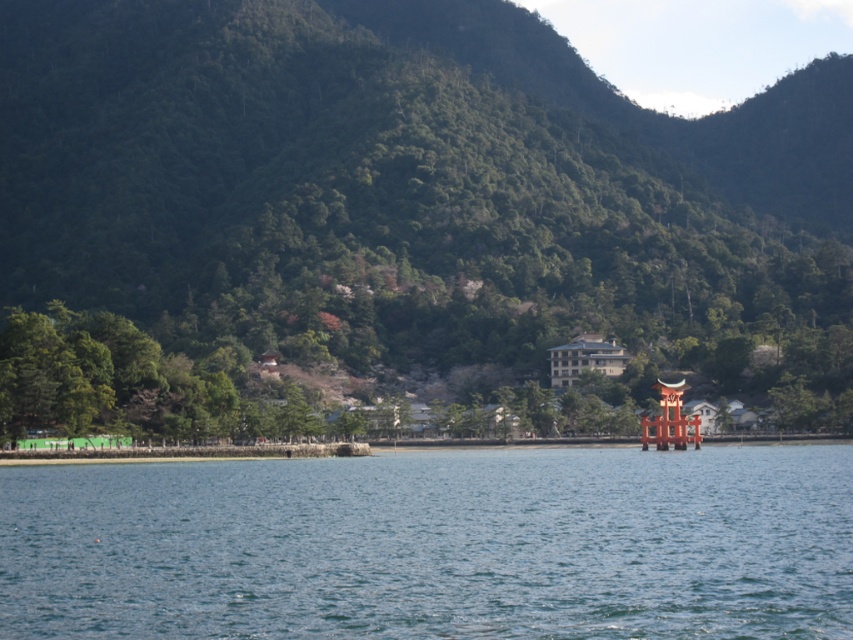
You are an artist planning to paint this landscape. You want to ensure the green leafy mountain at upper center and the clear blue water at center are proportionally accurate. Which object should you make wider in your painting?

The green leafy mountain at upper center should be made wider in the painting since its width is larger than the clear blue water at center according to the description.

Based on the scene description, where is the green leafy mountain at upper center located in terms of its 2D coordinates?

The green leafy mountain at upper center is located at the 2D coordinates of point (397, 212).